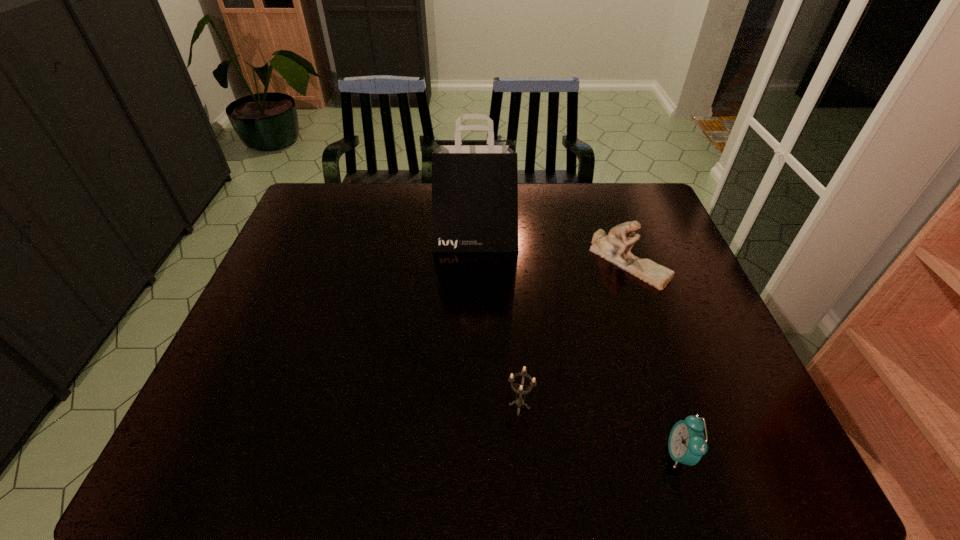
Where is `blank region between the candle holder and the tallest object`? blank region between the candle holder and the tallest object is located at coordinates (497, 323).

The width and height of the screenshot is (960, 540). I want to click on free space that is in between the figurine and the nearest object, so click(x=654, y=358).

Identify the location of vacant region between the tallest object and the alarm clock. The image size is (960, 540). (578, 347).

At what (x,y) coordinates should I click in order to perform the action: click on empty space between the second tallest object and the tallest object. Please return your answer as a coordinate pair (x, y). This screenshot has width=960, height=540. Looking at the image, I should click on (552, 251).

Image resolution: width=960 pixels, height=540 pixels. What are the coordinates of `free space between the nearest object and the second nearest object` in the screenshot? It's located at (600, 430).

Locate an element on the screen. empty space that is in between the figurine and the candle holder is located at coordinates (574, 334).

Locate an element on the screen. The height and width of the screenshot is (540, 960). vacant space that's between the candle holder and the shopping bag is located at coordinates (497, 323).

You are a GUI agent. You are given a task and a screenshot of the screen. Output one action in this format:
    pyautogui.click(x=<x>, y=<y>)
    Task: Click on the object that is the second closest to the alarm clock
    This screenshot has height=540, width=960.
    Given the screenshot: What is the action you would take?
    pyautogui.click(x=615, y=247)

Image resolution: width=960 pixels, height=540 pixels. Find the location of `object that ranks as the closest to the second nearest object`. object that ranks as the closest to the second nearest object is located at coordinates (687, 444).

Locate an element on the screen. The height and width of the screenshot is (540, 960). vacant space that satisfies the following two spatial constraints: 1. on the front-facing side of the figurine; 2. on the face of the alarm clock is located at coordinates (698, 454).